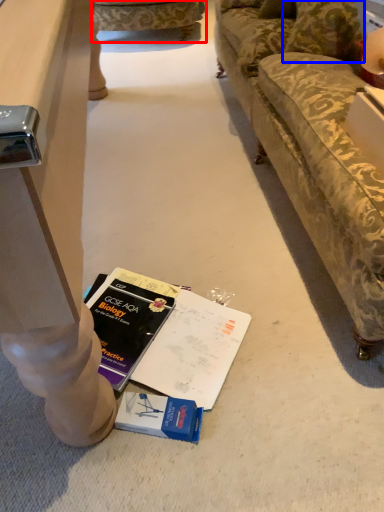
Question: Which point is closer to the camera, studio couch (highlighted by a red box) or pillow (highlighted by a blue box)?

Choices:
 (A) studio couch
 (B) pillow

Answer: (B)